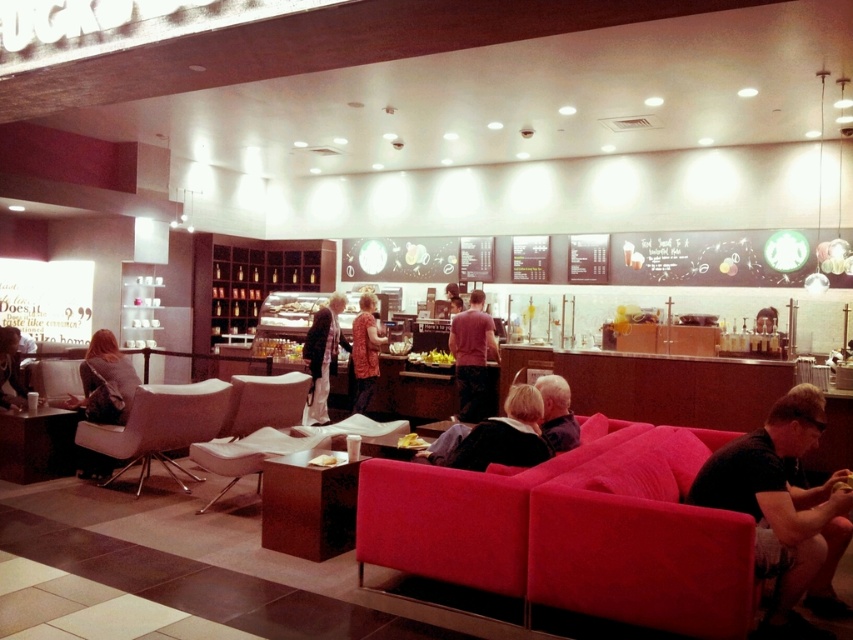
Can you confirm if yellow matte sandwich at center is smaller than golden crispy pastry at center?

No, yellow matte sandwich at center is not smaller than golden crispy pastry at center.

Does yellow matte sandwich at center appear under golden crispy pastry at center?

Incorrect, yellow matte sandwich at center is not positioned below golden crispy pastry at center.

This screenshot has width=853, height=640. Find the location of `yellow matte sandwich at center`. yellow matte sandwich at center is located at coordinates (412, 442).

Based on the photo, can you confirm if velvet red couch at lower right is thinner than dark gray sweater at center?

Incorrect, velvet red couch at lower right's width is not less than dark gray sweater at center's.

The width and height of the screenshot is (853, 640). Identify the location of velvet red couch at lower right. (567, 534).

Does matte white chair at lower left appear under dark gray sweater at center?

Yes, matte white chair at lower left is below dark gray sweater at center.

Is point (144, 404) positioned behind point (552, 428)?

Yes, it is behind point (552, 428).

You are a GUI agent. You are given a task and a screenshot of the screen. Output one action in this format:
    pyautogui.click(x=<x>, y=<y>)
    Task: Click on the matte white chair at lower left
    Image resolution: width=853 pixels, height=640 pixels.
    Given the screenshot: What is the action you would take?
    pyautogui.click(x=160, y=426)